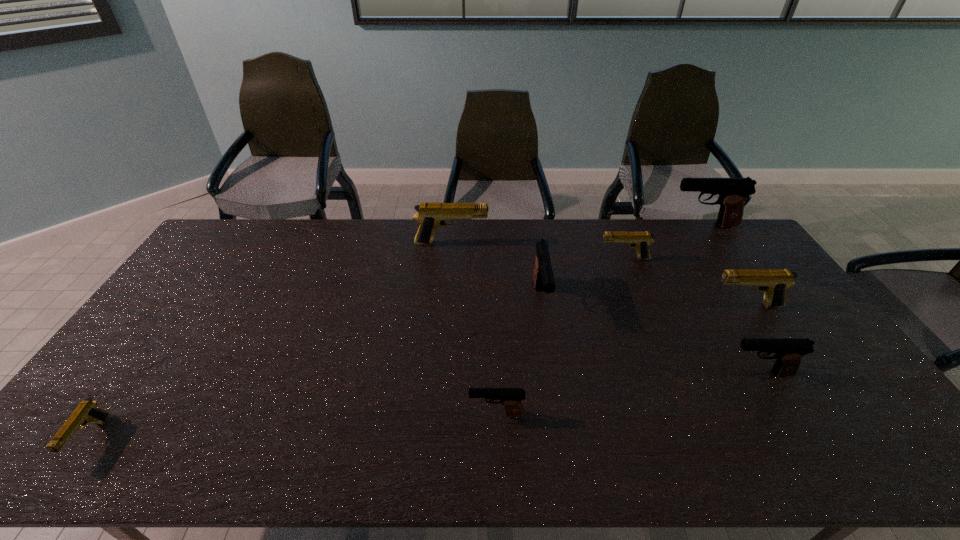
Locate an element on the screen. This screenshot has height=540, width=960. the farthest pistol is located at coordinates (732, 192).

The width and height of the screenshot is (960, 540). In order to click on the farthest black pistol in this screenshot , I will do `click(732, 192)`.

The width and height of the screenshot is (960, 540). I want to click on the second farthest black pistol, so click(543, 277).

Locate an element on the screen. This screenshot has width=960, height=540. the fourth object from left to right is located at coordinates (543, 277).

The height and width of the screenshot is (540, 960). I want to click on the third tan pistol from right to left, so click(x=431, y=216).

Where is `the second farthest object`? the second farthest object is located at coordinates (431, 216).

Locate an element on the screen. The image size is (960, 540). the second biggest tan pistol is located at coordinates (774, 283).

This screenshot has height=540, width=960. What are the coordinates of `the third farthest tan pistol` in the screenshot? It's located at (774, 283).

Where is `the third farthest black pistol`? The image size is (960, 540). the third farthest black pistol is located at coordinates (788, 352).

Image resolution: width=960 pixels, height=540 pixels. I want to click on the third nearest object, so click(788, 352).